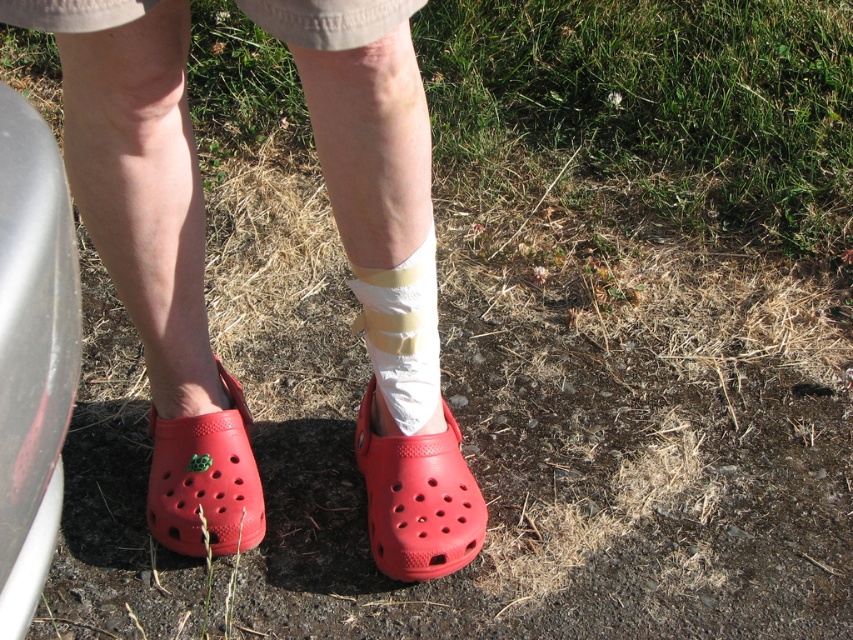
Can you confirm if matte rubber clog at lower left is bigger than white/textured bandage at lower center?

Correct, matte rubber clog at lower left is larger in size than white/textured bandage at lower center.

Between matte rubber clog at lower left and white/textured bandage at lower center, which one is positioned higher?

Positioned higher is matte rubber clog at lower left.

Find the location of a particular element. matte rubber clog at lower left is located at coordinates coord(154,250).

How far apart are rubber croc at center and rubber/crocs at lower left?

rubber croc at center and rubber/crocs at lower left are 12.05 inches apart.

Between rubber croc at center and rubber/crocs at lower left, which one appears on the left side from the viewer's perspective?

Positioned to the left is rubber/crocs at lower left.

Does point (392, 525) lie behind point (260, 525)?

That is False.

Locate an element on the screen. This screenshot has height=640, width=853. rubber croc at center is located at coordinates (418, 499).

Is rubber croc at center to the left of white/textured bandage at lower center from the viewer's perspective?

No, rubber croc at center is not to the left of white/textured bandage at lower center.

Can you confirm if rubber croc at center is taller than white/textured bandage at lower center?

In fact, rubber croc at center may be shorter than white/textured bandage at lower center.

This screenshot has height=640, width=853. I want to click on rubber croc at center, so click(x=418, y=499).